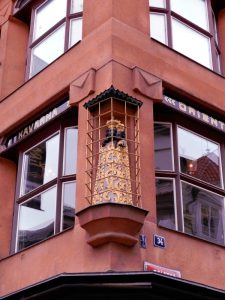
Identify the location of statue. (116, 130), (120, 163), (121, 199), (98, 194), (102, 175), (107, 148).